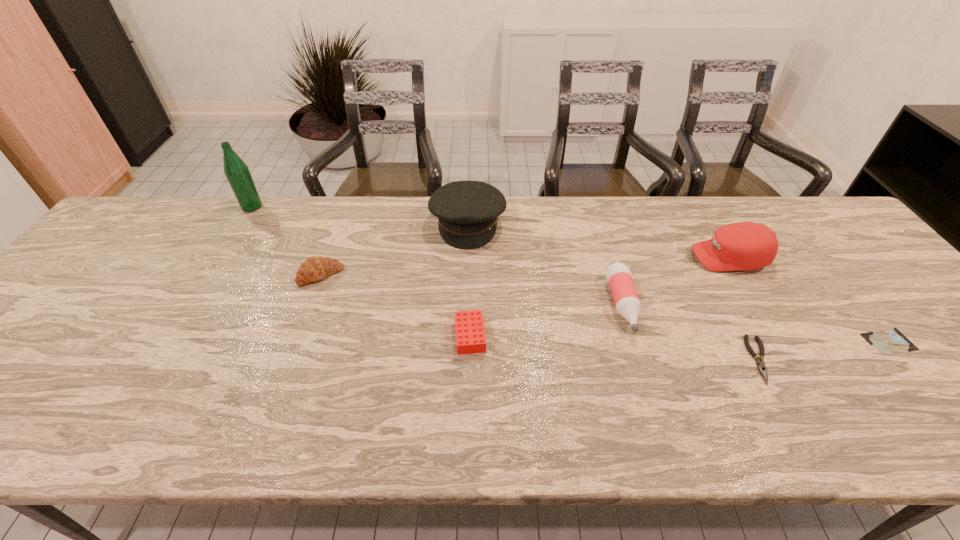
What are the coordinates of `the tallest object` in the screenshot? It's located at (237, 173).

Locate an element on the screen. the farther bottle is located at coordinates (237, 173).

The height and width of the screenshot is (540, 960). Identify the location of beret. (467, 211).

Identify the location of cap. The width and height of the screenshot is (960, 540). (745, 245).

This screenshot has height=540, width=960. I want to click on the right bottle, so click(x=618, y=275).

Image resolution: width=960 pixels, height=540 pixels. I want to click on the shorter bottle, so click(618, 275).

At what (x,y) coordinates should I click in order to perform the action: click on the seventh object from right to left. Please return your answer as a coordinate pair (x, y). Looking at the image, I should click on (314, 268).

Locate an element on the screen. The image size is (960, 540). the fifth tallest object is located at coordinates (314, 268).

You are a GUI agent. You are given a task and a screenshot of the screen. Output one action in this format:
    pyautogui.click(x=<x>, y=<y>)
    Task: Click on the Lego
    
    Given the screenshot: What is the action you would take?
    pyautogui.click(x=470, y=335)

Locate an element on the screen. This screenshot has height=540, width=960. the second shortest object is located at coordinates (760, 363).